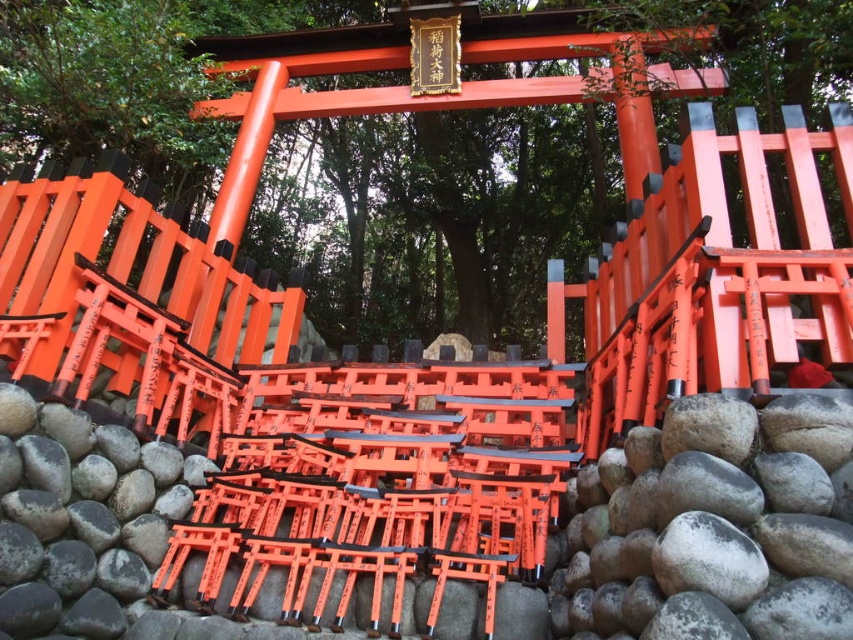
You are standing at the base of the torii gate and see a point marked at coordinates (714, 525). Based on the scene description, where is this point located?

The point is located on the gray rough rock at lower center.